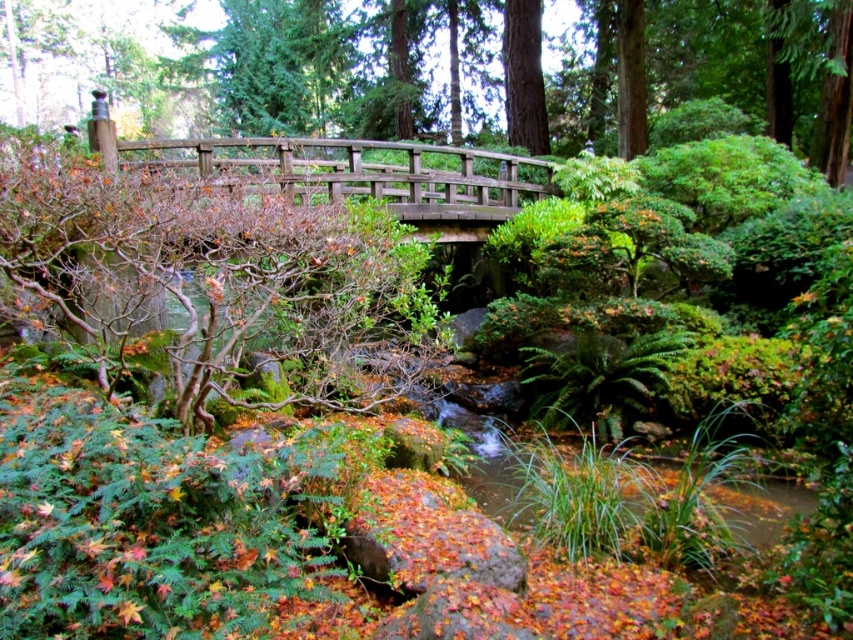
Question: Which point is closer to the camera taking this photo?

Choices:
 (A) (523, 90)
 (B) (802, 108)

Answer: (B)

Question: Among these points, which one is farthest from the camera?

Choices:
 (A) (506, 112)
 (B) (787, 1)

Answer: (A)

Question: Which point is farther to the camera?

Choices:
 (A) (643, 4)
 (B) (538, 44)

Answer: (B)

Question: Is brown wooden bridge at upper center below green rough bark tree at upper center?

Choices:
 (A) no
 (B) yes

Answer: (A)

Question: Does brown wooden bridge at upper center appear on the right side of green rough bark tree at upper center?

Choices:
 (A) no
 (B) yes

Answer: (A)

Question: Is brown wooden bridge at upper center above green rough bark tree at upper center?

Choices:
 (A) yes
 (B) no

Answer: (A)